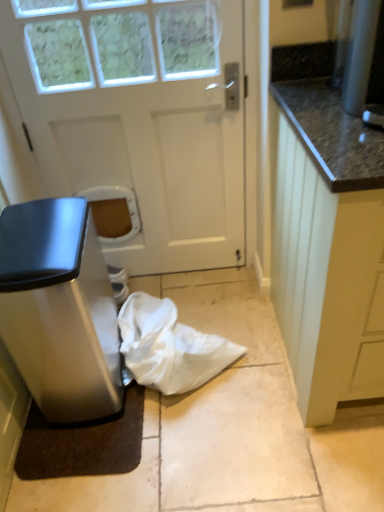
The height and width of the screenshot is (512, 384). Find the location of `free space in front of white fabric bag at lower center`. free space in front of white fabric bag at lower center is located at coordinates (205, 443).